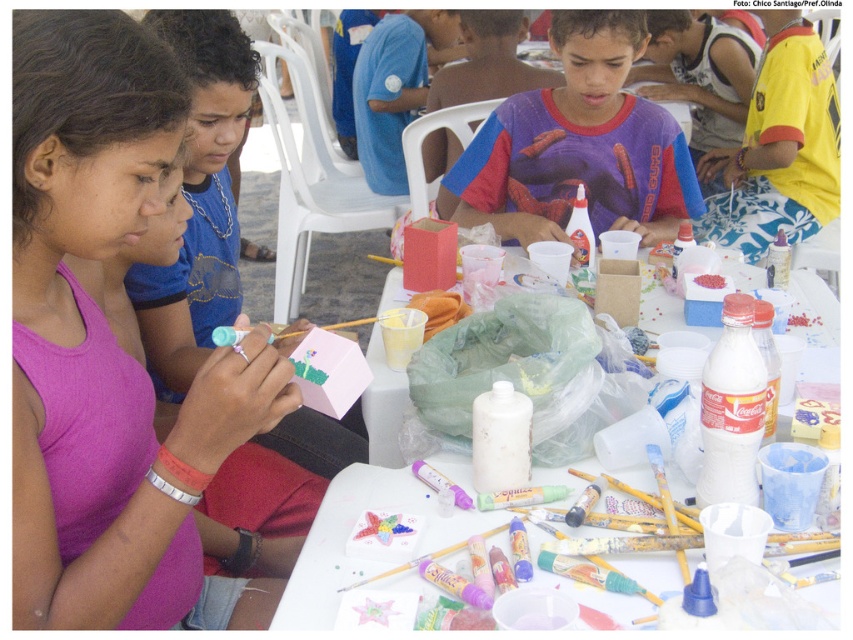
Which is more to the left, white plastic table at center or yellow fabric shorts at right?

From the viewer's perspective, white plastic table at center appears more on the left side.

Is white plastic table at center to the left of yellow fabric shorts at right from the viewer's perspective?

Correct, you'll find white plastic table at center to the left of yellow fabric shorts at right.

This screenshot has width=853, height=640. Describe the element at coordinates (347, 534) in the screenshot. I see `white plastic table at center` at that location.

The image size is (853, 640). In order to click on white plastic table at center in this screenshot , I will do `click(347, 534)`.

Based on the photo, can you confirm if pink matte tank top at center is thinner than matte pink paper at center?

Yes.

Is point (222, 369) closer to viewer compared to point (190, 365)?

Yes, it is.

You are a GUI agent. You are given a task and a screenshot of the screen. Output one action in this format:
    pyautogui.click(x=<x>, y=<y>)
    Task: Click on the pink matte tank top at center
    
    Given the screenshot: What is the action you would take?
    pyautogui.click(x=112, y=349)

You are a GUI agent. You are given a task and a screenshot of the screen. Output one action in this format:
    pyautogui.click(x=<x>, y=<y>)
    Task: Click on the purple matte shirt at center
    
    Given the screenshot: What is the action you would take?
    pyautogui.click(x=577, y=147)

Can you confirm if purple matte shirt at center is taller than yellow fabric shorts at right?

No, purple matte shirt at center is not taller than yellow fabric shorts at right.

Measure the distance between purple matte shirt at center and camera.

They are 1.82 meters apart.

The width and height of the screenshot is (853, 640). In order to click on purple matte shirt at center in this screenshot , I will do `click(577, 147)`.